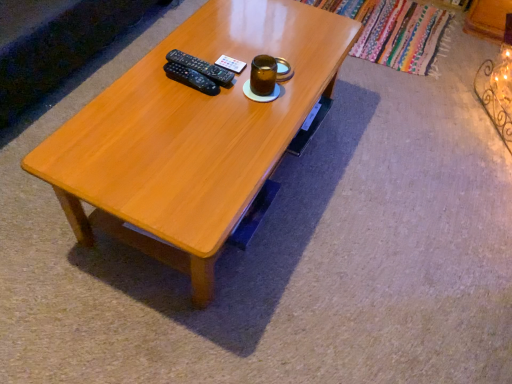
This screenshot has width=512, height=384. I want to click on light brown wood coffee table at center, so click(x=191, y=135).

The width and height of the screenshot is (512, 384). I want to click on black plastic remote at center, so [x=202, y=67].

Can you confirm if brown glass jar at upper center is shorter than light brown wood coffee table at center?

Correct, brown glass jar at upper center is not as tall as light brown wood coffee table at center.

From the image's perspective, which one is positioned higher, brown glass jar at upper center or light brown wood coffee table at center?

brown glass jar at upper center, from the image's perspective.

Could you tell me if light brown wood coffee table at center is turned towards black plastic remote at center?

No, light brown wood coffee table at center is not oriented towards black plastic remote at center.

From the image's perspective, relative to black plastic remote at center, is light brown wood coffee table at center above or below?

light brown wood coffee table at center is below black plastic remote at center.

Visually, is light brown wood coffee table at center positioned to the left or to the right of black plastic remote at center?

From the image, it's evident that light brown wood coffee table at center is to the right of black plastic remote at center.

Is light brown wood coffee table at center with black plastic remote at center?

light brown wood coffee table at center and black plastic remote at center are clearly separated.

Is brown glass jar at upper center far from black plastic remote at center?

No, brown glass jar at upper center is not far away from black plastic remote at center.

Relative to black plastic remote at center, is brown glass jar at upper center in front or behind?

Visually, brown glass jar at upper center is located in front of black plastic remote at center.

Based on the photo, is brown glass jar at upper center shorter than black plastic remote at center?

Incorrect, the height of brown glass jar at upper center does not fall short of that of black plastic remote at center.

Measure the distance between brown glass jar at upper center and black plastic remote at center.

brown glass jar at upper center and black plastic remote at center are 4.98 inches apart.

Could light brown wood coffee table at center be considered to be inside black plastic remote at center?

No.

How far apart are black plastic remote at center and light brown wood coffee table at center?

black plastic remote at center is 11.88 inches from light brown wood coffee table at center.

Is black plastic remote at center to the left of light brown wood coffee table at center from the viewer's perspective?

Yes, black plastic remote at center is to the left of light brown wood coffee table at center.

I want to click on remote above the light brown wood coffee table at center (from the image's perspective), so click(202, 67).

From the image's perspective, which one is positioned higher, light brown wood coffee table at center or brown glass jar at upper center?

brown glass jar at upper center is shown above in the image.

Is brown glass jar at upper center at the back of light brown wood coffee table at center?

No, light brown wood coffee table at center is not facing the opposite direction of brown glass jar at upper center.

The height and width of the screenshot is (384, 512). What are the coordinates of `coffee table in front of the brown glass jar at upper center` in the screenshot? It's located at (191, 135).

Considering the relative positions of light brown wood coffee table at center and brown glass jar at upper center in the image provided, is light brown wood coffee table at center to the right of brown glass jar at upper center from the viewer's perspective?

In fact, light brown wood coffee table at center is to the left of brown glass jar at upper center.

Is black plastic remote at center far from brown glass jar at upper center?

No.

Consider the image. Which is correct: black plastic remote at center is inside brown glass jar at upper center, or outside of it?

black plastic remote at center is not enclosed by brown glass jar at upper center.

Which of these two, black plastic remote at center or brown glass jar at upper center, is thinner?

Thinner between the two is brown glass jar at upper center.

In the scene shown: Considering the sizes of objects black plastic remote at center and brown glass jar at upper center in the image provided, who is shorter, black plastic remote at center or brown glass jar at upper center?

Standing shorter between the two is black plastic remote at center.

In order to click on beverage lying on the right of light brown wood coffee table at center in this screenshot , I will do `click(263, 75)`.

Find the location of a particular element. The width and height of the screenshot is (512, 384). remote that is on the left side of light brown wood coffee table at center is located at coordinates (202, 67).

Estimate the real-world distances between objects in this image. Which object is closer to light brown wood coffee table at center, brown glass jar at upper center or black plastic remote at center?

Among the two, black plastic remote at center is located nearer to light brown wood coffee table at center.

Estimate the real-world distances between objects in this image. Which object is closer to black plastic remote at center, light brown wood coffee table at center or brown glass jar at upper center?

brown glass jar at upper center is positioned closer to the anchor black plastic remote at center.

When comparing their distances from light brown wood coffee table at center, does black plastic remote at center or brown glass jar at upper center seem closer?

black plastic remote at center lies closer to light brown wood coffee table at center than the other object.

From the image, which object appears to be farther from black plastic remote at center, brown glass jar at upper center or light brown wood coffee table at center?

light brown wood coffee table at center.

Which object lies nearer to the anchor point brown glass jar at upper center, light brown wood coffee table at center or black plastic remote at center?

Among the two, black plastic remote at center is located nearer to brown glass jar at upper center.

When comparing their distances from brown glass jar at upper center, does black plastic remote at center or light brown wood coffee table at center seem closer?

black plastic remote at center is positioned closer to the anchor brown glass jar at upper center.

Identify the location of beverage between light brown wood coffee table at center and black plastic remote at center from front to back. click(x=263, y=75).